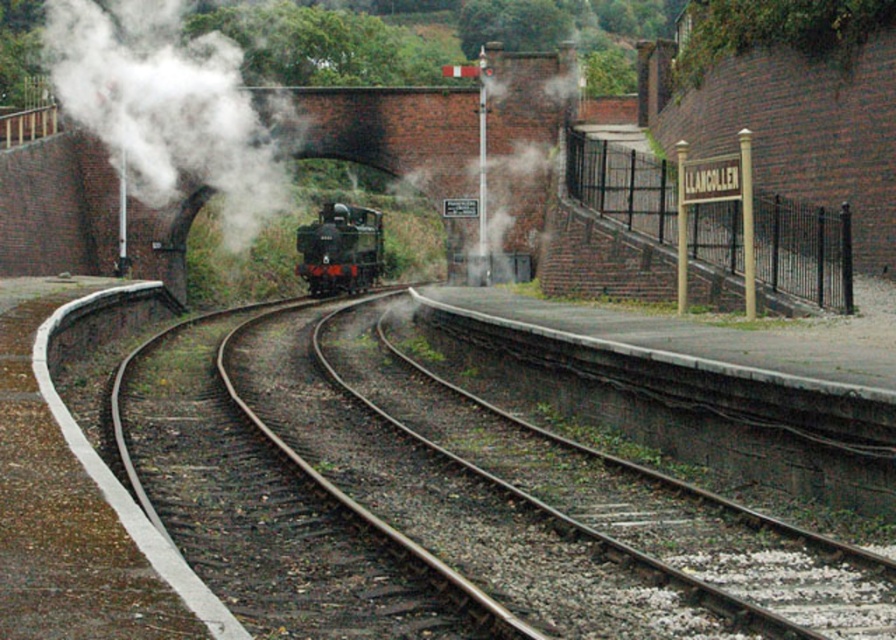
You are a railway inspector checking the alignment of the tracks and the steam plume. According to the scene, which object is narrower between the smooth steel tracks at center and the white vapor at center?

The smooth steel tracks at center are narrower compared to the white vapor at center.

Based on the photo, you are a photographer standing on the platform at Llangollen station. You want to capture the steam locomotive and its surroundings. Which object, the smooth steel tracks at center or the white vapor at center, would appear lower in your photo?

The smooth steel tracks at center would appear lower in your photo because they have a lesser height compared to the white vapor at center.

You are a passenger waiting at the Llangollen railway station. You notice the gold metal sign at upper right and the green polished wood train at center. Which object is shorter in height?

The gold metal sign at upper right has a lesser height compared to the green polished wood train at center, so the gold metal sign at upper right is shorter in height.